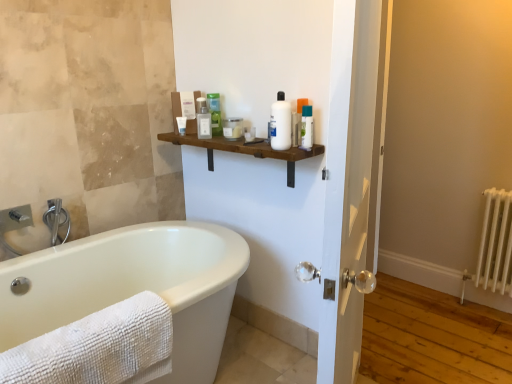
Question: Relative to translucent plastic jar at upper center, placed as the fourth toiletry when sorted from left to right, is green matte bottle at upper center, which is the third toiletry from left to right, in front or behind?

Choices:
 (A) behind
 (B) front

Answer: (A)

Question: From the image's perspective, is green matte bottle at upper center, the fourth toiletry in the right-to-left sequence, located above or below translucent plastic jar at upper center, placed as the fourth toiletry when sorted from left to right?

Choices:
 (A) below
 (B) above

Answer: (B)

Question: Estimate the real-world distances between objects in this image. Which object is farther from the green matte bottle at upper center, the fourth toiletry in the right-to-left sequence?

Choices:
 (A) brushed metal faucet at left
 (B) white metallic radiator at right
 (C) brushed metal faucet at left
 (D) translucent plastic tube at upper center, which appears as the 1th toiletry when viewed from the right
 (E) translucent plastic bottle at upper center, acting as the 2th toiletry starting from the left

Answer: (B)

Question: Which object is the closest to the green matte bottle at upper center, the fourth toiletry in the right-to-left sequence?

Choices:
 (A) brushed metal faucet at left
 (B) white glossy bottle at center, which is counted as the fifth toiletry, starting from the left
 (C) white matte tube at upper center, which is the 1th toiletry in left-to-right order
 (D) white textured towel at lower left
 (E) translucent plastic jar at upper center, acting as the third toiletry starting from the right

Answer: (E)